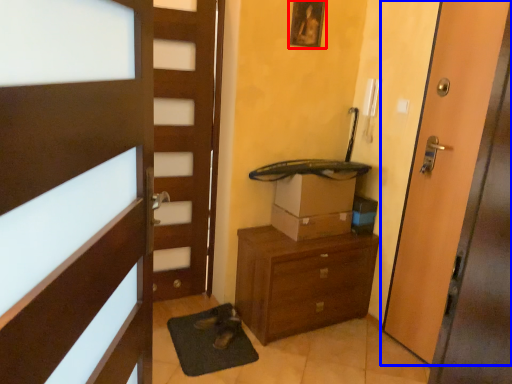
Question: Which of the following is the closest to the observer, picture frame (highlighted by a red box) or door (highlighted by a blue box)?

Choices:
 (A) picture frame
 (B) door

Answer: (B)